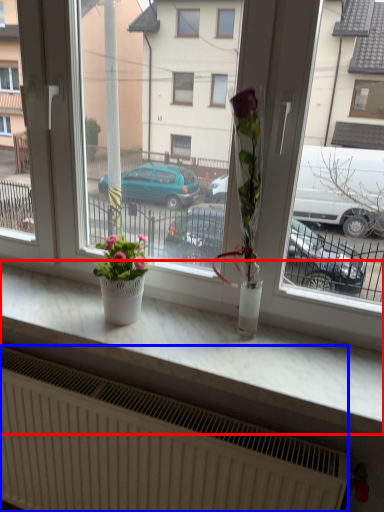
Question: Which object is closer to the camera taking this photo, counter top (highlighted by a red box) or radiator (highlighted by a blue box)?

Choices:
 (A) counter top
 (B) radiator

Answer: (A)